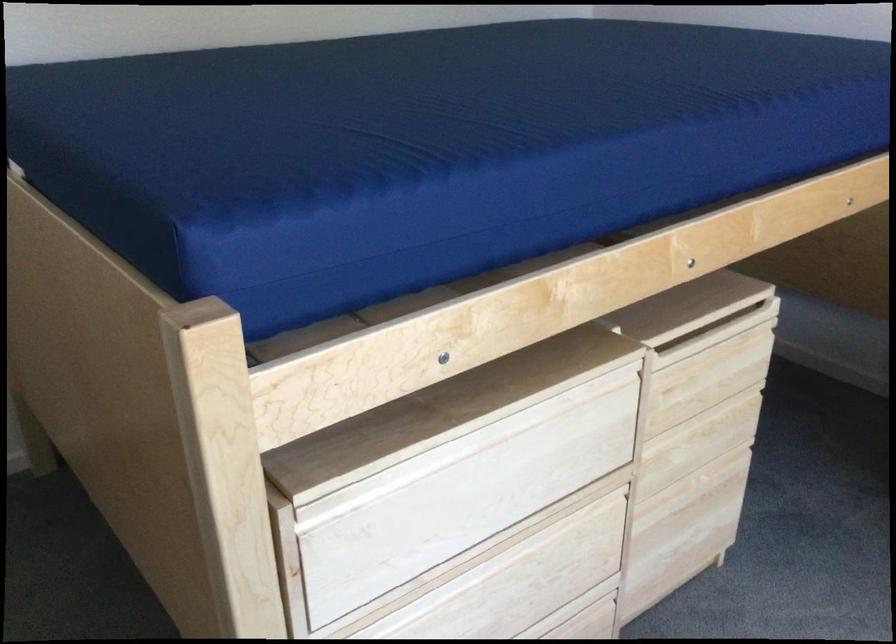
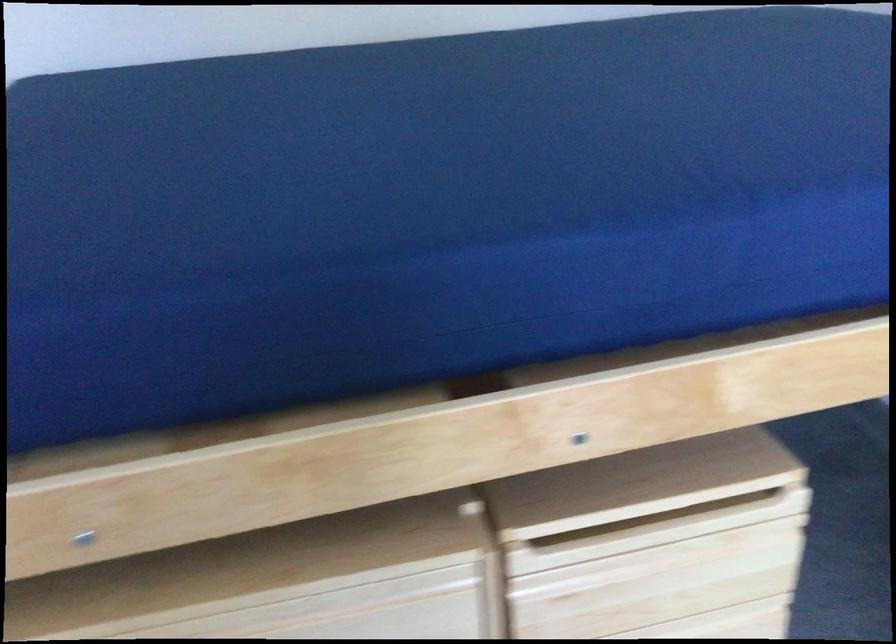
Locate, in the second image, the point that corresponds to (x=711, y=360) in the first image.

(668, 559)